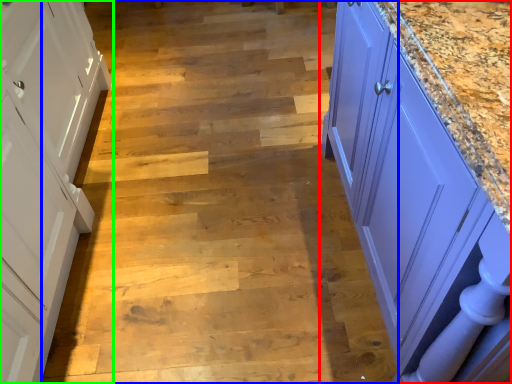
Question: Which object is positioned closest to countertop (highlighted by a red box)? Select from stair (highlighted by a blue box) and cabinetry (highlighted by a green box).

Choices:
 (A) stair
 (B) cabinetry

Answer: (A)